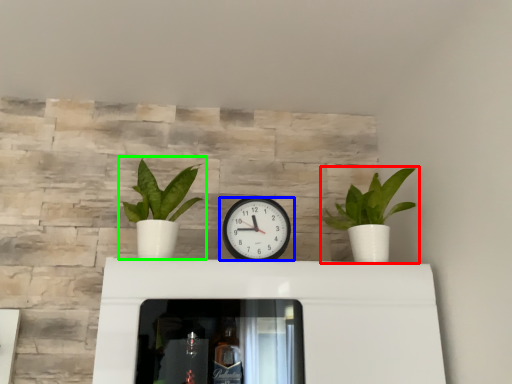
Question: Considering the real-world distances, which object is closest to houseplant (highlighted by a red box)? wall clock (highlighted by a blue box) or houseplant (highlighted by a green box).

Choices:
 (A) wall clock
 (B) houseplant

Answer: (A)